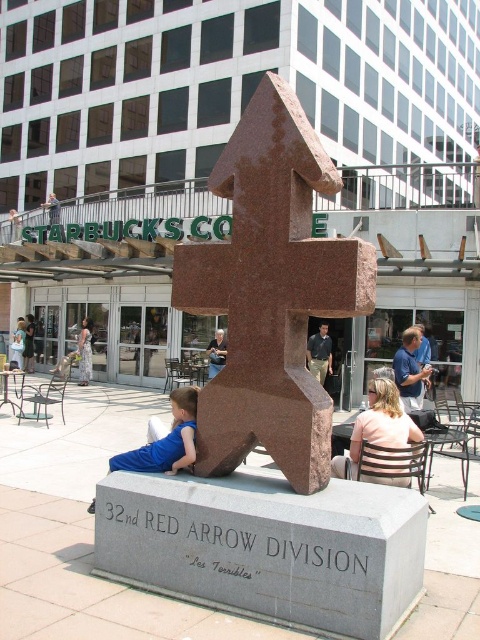
Question: Which object is farther from the camera taking this photo?

Choices:
 (A) peach fabric shirt at center
 (B) blue denim jeans at center
 (C) blue fabric shirt at lower left
 (D) brown stone sculpture at center

Answer: (B)

Question: Among these objects, which one is nearest to the camera?

Choices:
 (A) blue fabric shirt at lower left
 (B) brown stone sculpture at center

Answer: (B)

Question: Does peach fabric shirt at center appear on the left side of blue fabric shirt at lower left?

Choices:
 (A) yes
 (B) no

Answer: (B)

Question: Can you confirm if peach fabric shirt at center is wider than blue denim jeans at center?

Choices:
 (A) yes
 (B) no

Answer: (A)

Question: Among these objects, which one is nearest to the camera?

Choices:
 (A) printed floral dress at center
 (B) blue denim jeans at center

Answer: (B)

Question: Does brown stone sculpture at center appear on the left side of printed floral dress at center?

Choices:
 (A) no
 (B) yes

Answer: (A)